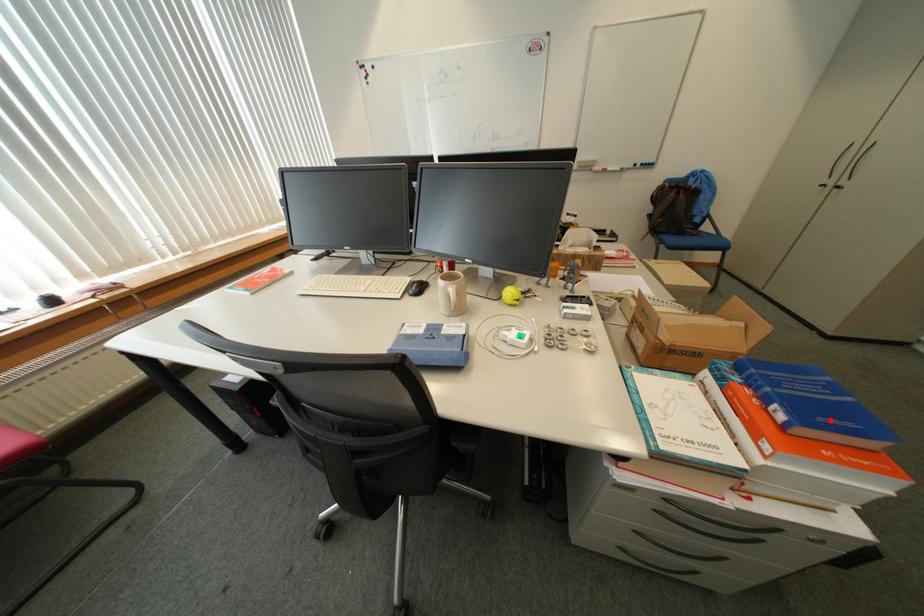
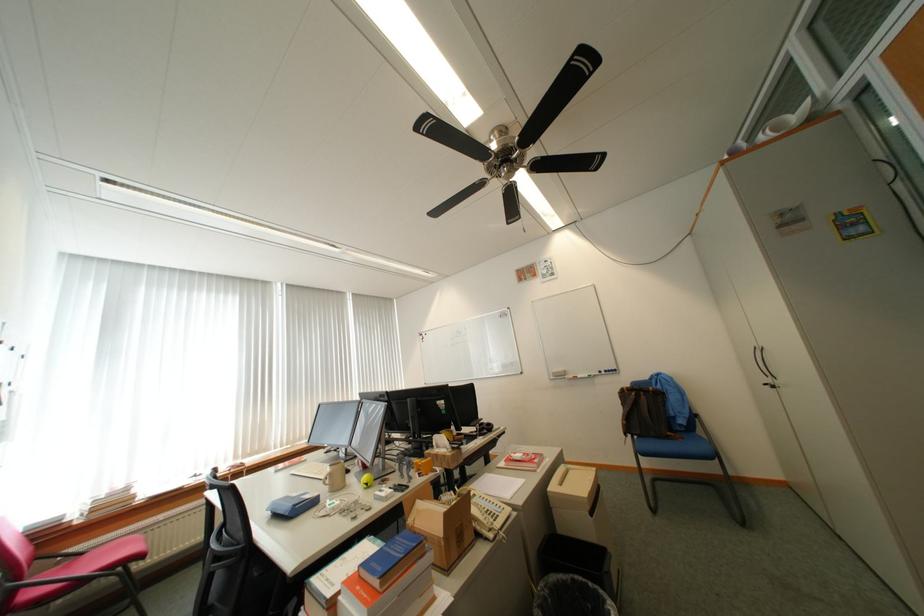
The point at the highlighted location is marked in the first image. Where is the corresponding point in the second image?

(383, 565)